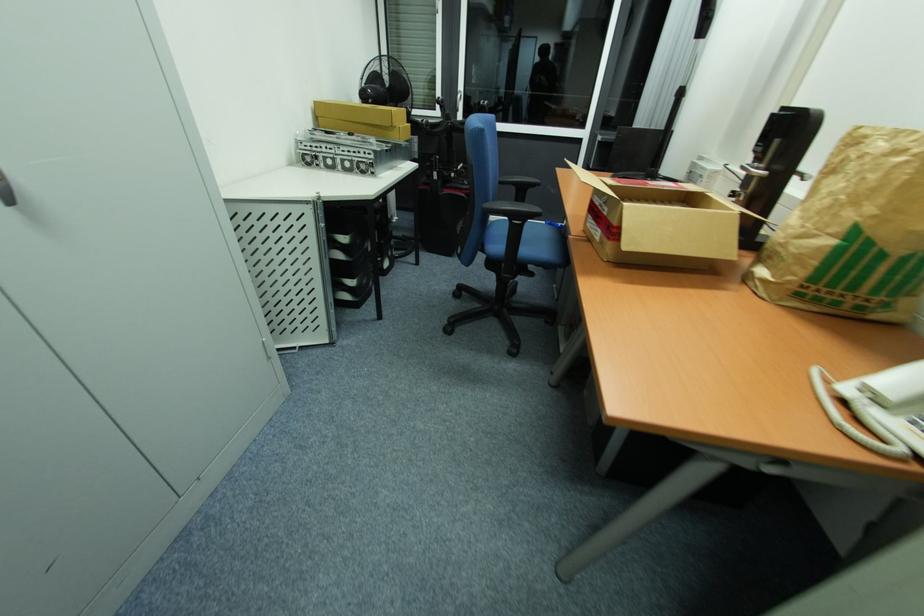
This screenshot has height=616, width=924. Describe the element at coordinates (762, 203) in the screenshot. I see `a black device handle` at that location.